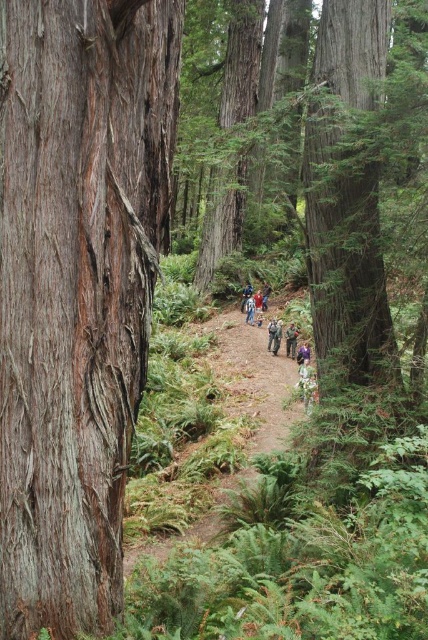
Does brown dirt path at center have a lesser height compared to green camouflage jacket at center?

No, brown dirt path at center is not shorter than green camouflage jacket at center.

At what (x,y) coordinates should I click in order to perform the action: click on brown dirt path at center. Please return your answer as a coordinate pair (x, y). Looking at the image, I should click on (252, 381).

Locate an element on the screen. This screenshot has width=428, height=640. brown dirt path at center is located at coordinates (252, 381).

Can you confirm if camouflage jacket at center is shorter than blue jeans at center?

No, camouflage jacket at center is not shorter than blue jeans at center.

Who is more forward, (311, 323) or (252, 310)?

Point (311, 323)

I want to click on camouflage jacket at center, so click(297, 348).